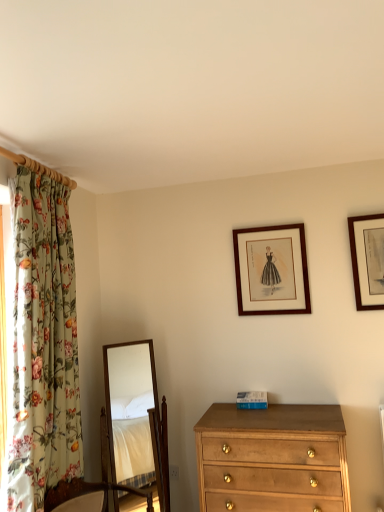
Question: From a real-world perspective, is wooden framed print at upper center, the first picture frame positioned from the back, on light brown wood chest of drawers at lower right?

Choices:
 (A) yes
 (B) no

Answer: (A)

Question: Is wooden framed print at upper center, which is the 2th picture frame from right to left, closer to the viewer compared to light brown wood chest of drawers at lower right?

Choices:
 (A) no
 (B) yes

Answer: (A)

Question: Would you say wooden framed print at upper center, acting as the second picture frame starting from the front, contains light brown wood chest of drawers at lower right?

Choices:
 (A) no
 (B) yes

Answer: (A)

Question: Does wooden framed print at upper center, the first picture frame positioned from the back, come behind light brown wood chest of drawers at lower right?

Choices:
 (A) yes
 (B) no

Answer: (A)

Question: Is wooden framed print at upper center, acting as the second picture frame starting from the front, aimed at light brown wood chest of drawers at lower right?

Choices:
 (A) yes
 (B) no

Answer: (B)

Question: From the image's perspective, does wooden framed print at upper center, which is the 2th picture frame from right to left, appear lower than light brown wood chest of drawers at lower right?

Choices:
 (A) yes
 (B) no

Answer: (B)

Question: Could you tell me if floral fabric curtain at left is turned towards wooden picture frame at upper right, which is the second picture frame from left to right?

Choices:
 (A) yes
 (B) no

Answer: (B)

Question: Is floral fabric curtain at left surrounding wooden picture frame at upper right, the 2th picture frame viewed from the back?

Choices:
 (A) no
 (B) yes

Answer: (A)

Question: Considering the relative sizes of floral fabric curtain at left and wooden picture frame at upper right, the 2th picture frame viewed from the back, in the image provided, is floral fabric curtain at left taller than wooden picture frame at upper right, the 2th picture frame viewed from the back,?

Choices:
 (A) yes
 (B) no

Answer: (A)

Question: Does floral fabric curtain at left come in front of wooden picture frame at upper right, marked as the first picture frame in a right-to-left arrangement?

Choices:
 (A) yes
 (B) no

Answer: (A)

Question: Is floral fabric curtain at left with wooden picture frame at upper right, which is the second picture frame from left to right?

Choices:
 (A) yes
 (B) no

Answer: (B)

Question: Does floral fabric curtain at left lie behind wooden picture frame at upper right, which is the second picture frame from left to right?

Choices:
 (A) yes
 (B) no

Answer: (B)

Question: Is wooden mirror at center to the right of wooden picture frame at upper right, marked as the first picture frame in a right-to-left arrangement, from the viewer's perspective?

Choices:
 (A) no
 (B) yes

Answer: (A)